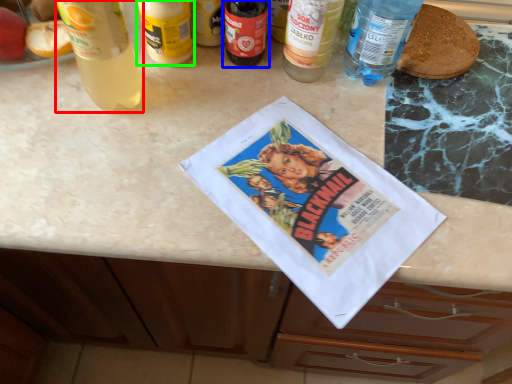
Question: Which object is positioned closest to bottle (highlighted by a red box)? Select from bottle (highlighted by a blue box) and bottle (highlighted by a green box).

Choices:
 (A) bottle
 (B) bottle

Answer: (B)